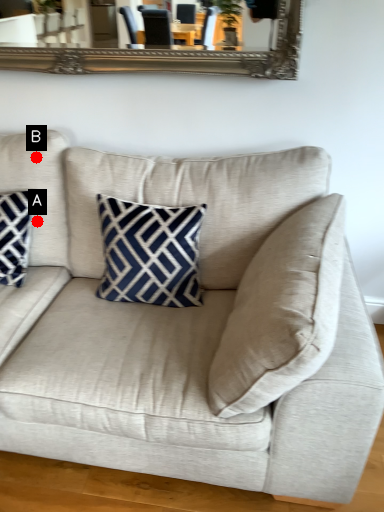
Question: Two points are circled on the image, labeled by A and B beside each circle. Which of the following is the farthest from the observer?

Choices:
 (A) A is further
 (B) B is further

Answer: (A)